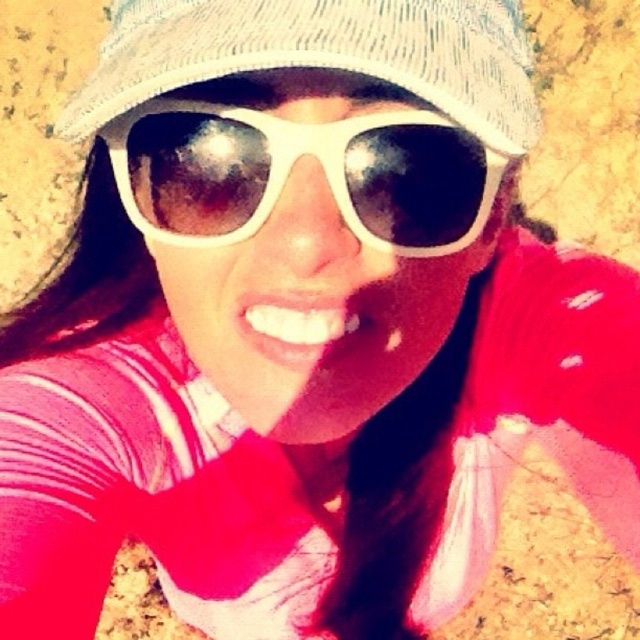
Can you confirm if white plastic sunglasses at center is taller than woven fabric baseball hat at upper center?

In fact, white plastic sunglasses at center may be shorter than woven fabric baseball hat at upper center.

Is white plastic sunglasses at center further to the viewer compared to woven fabric baseball hat at upper center?

Yes, it is behind woven fabric baseball hat at upper center.

Based on the photo, who is more forward, (372, 205) or (396, 77)?

Point (396, 77) is in front.

This screenshot has height=640, width=640. Identify the location of white plastic sunglasses at center. (291, 168).